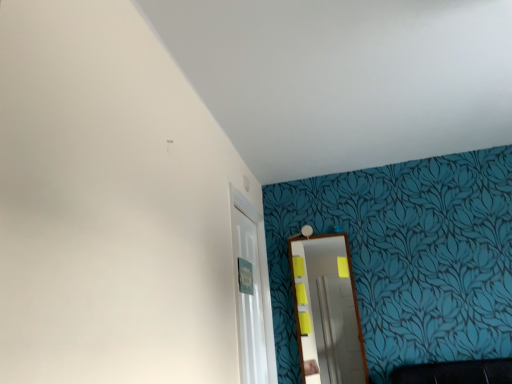
Question: Can you confirm if wooden mirror at center is smaller than white glossy door at center?

Choices:
 (A) no
 (B) yes

Answer: (B)

Question: Is white glossy door at center located within wooden mirror at center?

Choices:
 (A) no
 (B) yes

Answer: (A)

Question: Considering the relative sizes of wooden mirror at center and white glossy door at center in the image provided, is wooden mirror at center wider than white glossy door at center?

Choices:
 (A) yes
 (B) no

Answer: (B)

Question: Can you confirm if wooden mirror at center is positioned to the right of white glossy door at center?

Choices:
 (A) yes
 (B) no

Answer: (A)

Question: Is wooden mirror at center bigger than white glossy door at center?

Choices:
 (A) no
 (B) yes

Answer: (A)

Question: Is wooden mirror at center not inside white glossy door at center?

Choices:
 (A) yes
 (B) no

Answer: (A)

Question: Can you confirm if white glossy door at center is taller than wooden mirror at center?

Choices:
 (A) yes
 (B) no

Answer: (A)

Question: Is white glossy door at center outside of wooden mirror at center?

Choices:
 (A) no
 (B) yes

Answer: (B)

Question: From the image's perspective, is white glossy door at center below wooden mirror at center?

Choices:
 (A) no
 (B) yes

Answer: (A)

Question: Can you confirm if white glossy door at center is thinner than wooden mirror at center?

Choices:
 (A) yes
 (B) no

Answer: (B)

Question: Is wooden mirror at center at the back of white glossy door at center?

Choices:
 (A) yes
 (B) no

Answer: (B)

Question: Are white glossy door at center and wooden mirror at center beside each other?

Choices:
 (A) no
 (B) yes

Answer: (A)

Question: From a real-world perspective, is wooden mirror at center above or below white glossy door at center?

Choices:
 (A) below
 (B) above

Answer: (A)